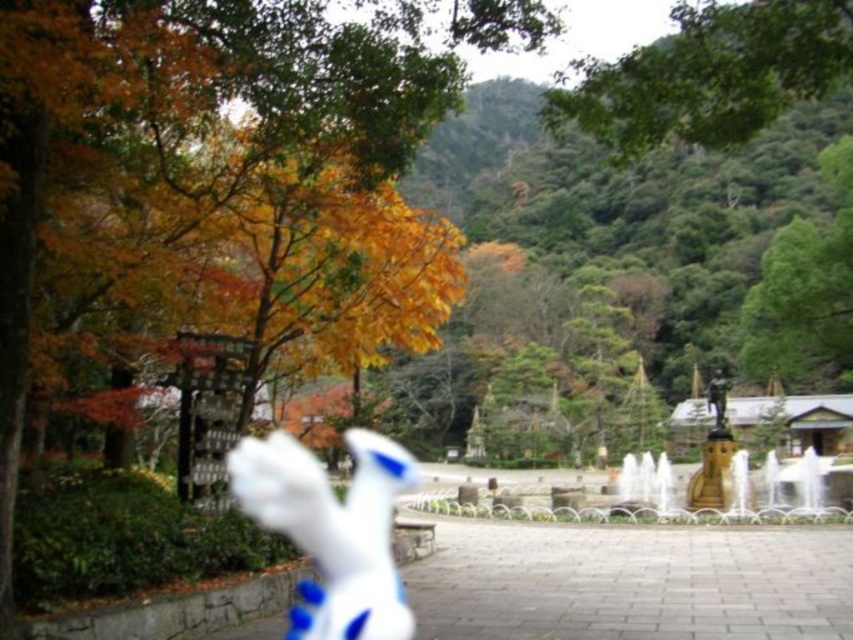
You are standing in the park and see two points marked in the scene. Which point is nearer to you, point at coordinate (601, 81) or point at coordinate (679, 513)?

Point at coordinate (601, 81) is closer to the viewer than point at coordinate (679, 513).

You are standing in the park and see the green leafy tree at upper center and the gold metallic fountain at center right. Which object is closer to your left side?

The green leafy tree at upper center is closer to your left side because it is positioned to the left of the gold metallic fountain at center right.